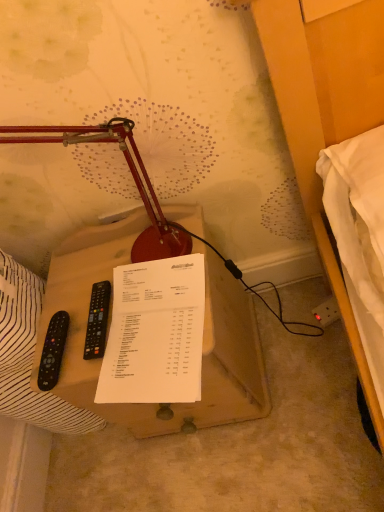
At what (x,y) coordinates should I click in order to perform the action: click on free space between black plastic remote control at left, which is the 1th remote control in right-to-left order, and black plastic remote at left, which is the 1th remote control in left-to-right order. Please return your answer as a coordinate pair (x, y). Looking at the image, I should click on coord(78,336).